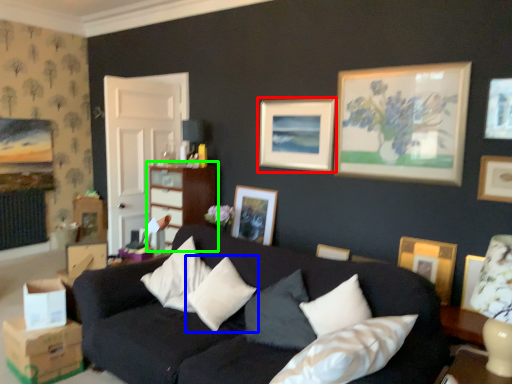
Question: Based on their relative distances, which object is farther from picture frame (highlighted by a red box)? Choose from pillow (highlighted by a blue box) and dresser (highlighted by a green box).

Choices:
 (A) pillow
 (B) dresser

Answer: (A)